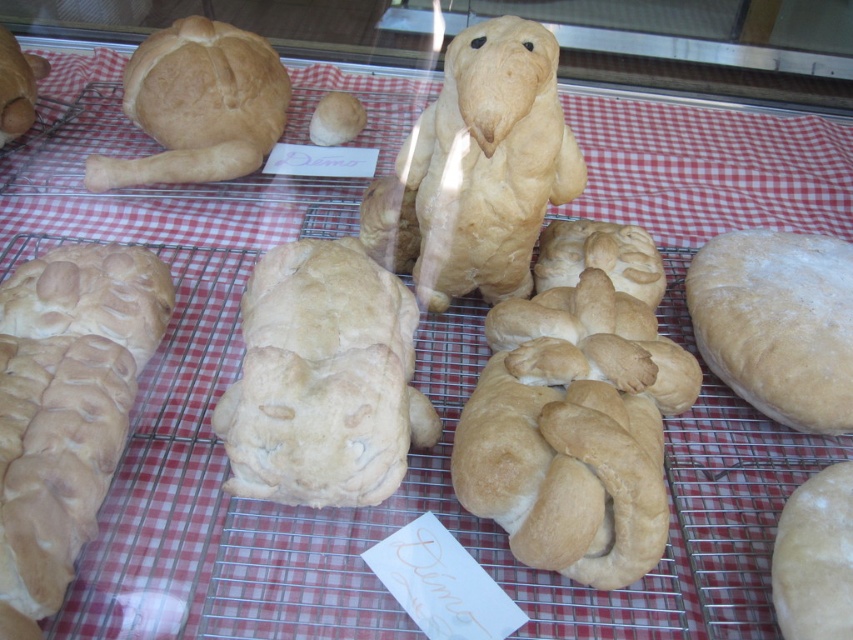
You are a baker who wants to place both the golden brown crusty loaf at lower left and the golden brown crusty loaf at upper left into a rectangular box that can only hold the larger one. Which loaf should you choose to fit into the box?

The golden brown crusty loaf at lower left is larger in size than the golden brown crusty loaf at upper left, so you should choose the golden brown crusty loaf at lower left to fit into the box.

You are a baker who wants to pack the golden brown doughnut at center and the golden brown crusty loaf at upper left into a box. The box can only hold items that are smaller than 30 cm in diameter. Based on the description, will both items fit?

The golden brown doughnut at center has a smaller size compared to golden brown crusty loaf at upper left. Since the doughnut is smaller, it might fit in the box, but the crusty loaf might be too large. However, without knowing the exact size of the crusty loaf, we can only assume the doughnut fits if it is under 30 cm. The answer is inconclusive without more information.

You are a baker who wants to stack the golden brown doughnut at center and the golden brown crusty loaf at upper left on a round plate. Since the plate can only hold items up to 3 cm thick, will both fit?

The golden brown doughnut at center is thinner than golden brown crusty loaf at upper left. However, since the crusty loaf at upper left is thicker than the doughnut, and the plate can only hold items up to 3 cm thick, we need to know the exact thickness of the crusty loaf. If the crusty loaf exceeds 3 cm, it won